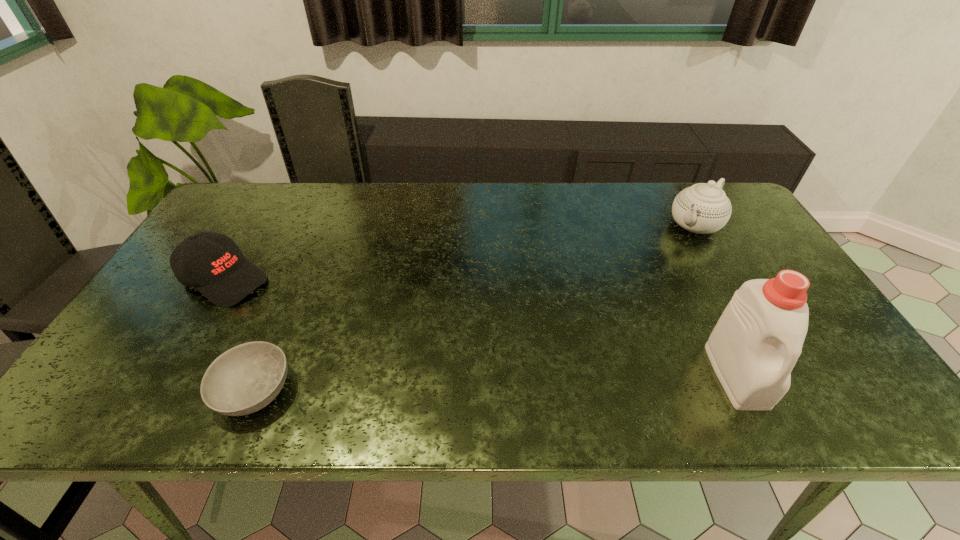
Find the location of a particular element. This screenshot has height=540, width=960. free space on the desktop that is between the bowl and the detergent and is positioned on the spout of the second tallest object is located at coordinates (531, 382).

Where is `free space on the desktop that is between the third object from right to left and the tallest object and is positioned on the front-facing side of the third nearest object`? This screenshot has height=540, width=960. free space on the desktop that is between the third object from right to left and the tallest object and is positioned on the front-facing side of the third nearest object is located at coordinates (431, 386).